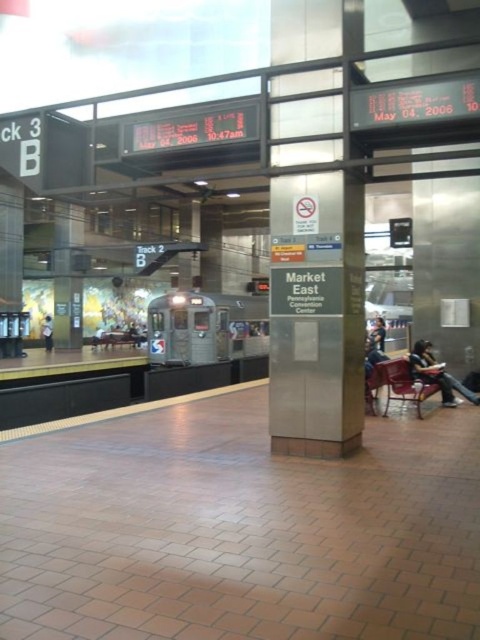
You are a passenger waiting at the Market East station. You see the silver metallic train at center and the dark blue jeans at center. Which object is closer to you?

The dark blue jeans at center are closer to you because the silver metallic train at center is positioned over them, indicating the train is behind the jeans.